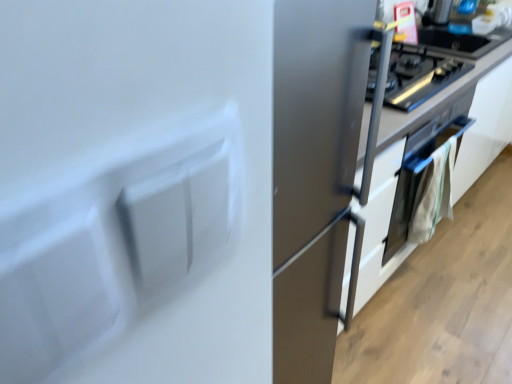
Question: Which is correct: satin silver oven at lower right is inside white matte refrigerator at center, or outside of it?

Choices:
 (A) inside
 (B) outside

Answer: (B)

Question: Considering the positions of satin silver oven at lower right and white matte refrigerator at center in the image, is satin silver oven at lower right wider or thinner than white matte refrigerator at center?

Choices:
 (A) thin
 (B) wide

Answer: (A)

Question: Which of these objects is positioned farthest from the white matte refrigerator at center?

Choices:
 (A) satin silver oven at upper right
 (B) satin silver oven at lower right
 (C) satin white cabinet at center

Answer: (B)

Question: Considering the real-world distances, which object is farthest from the satin silver oven at upper right?

Choices:
 (A) white matte refrigerator at center
 (B) satin silver oven at lower right
 (C) satin white cabinet at center

Answer: (A)